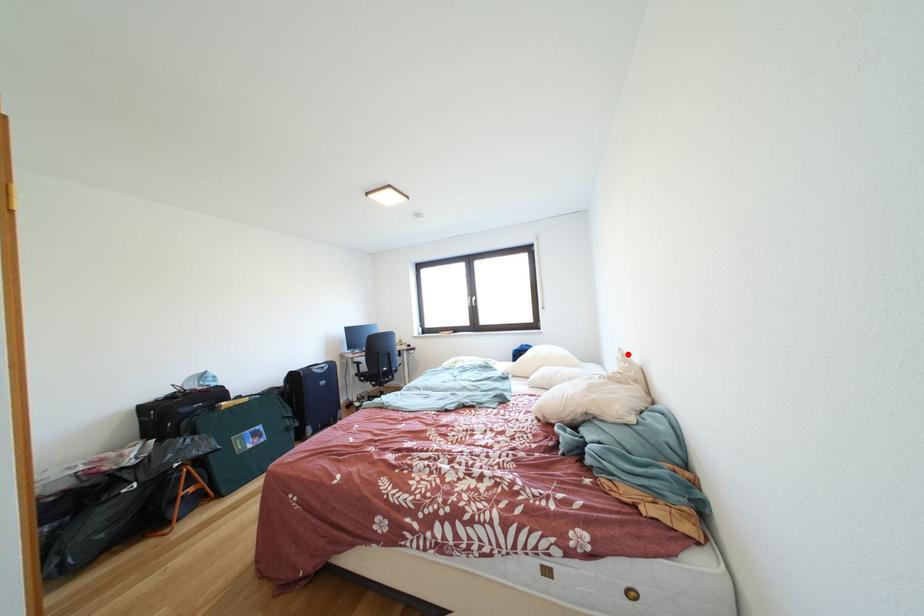
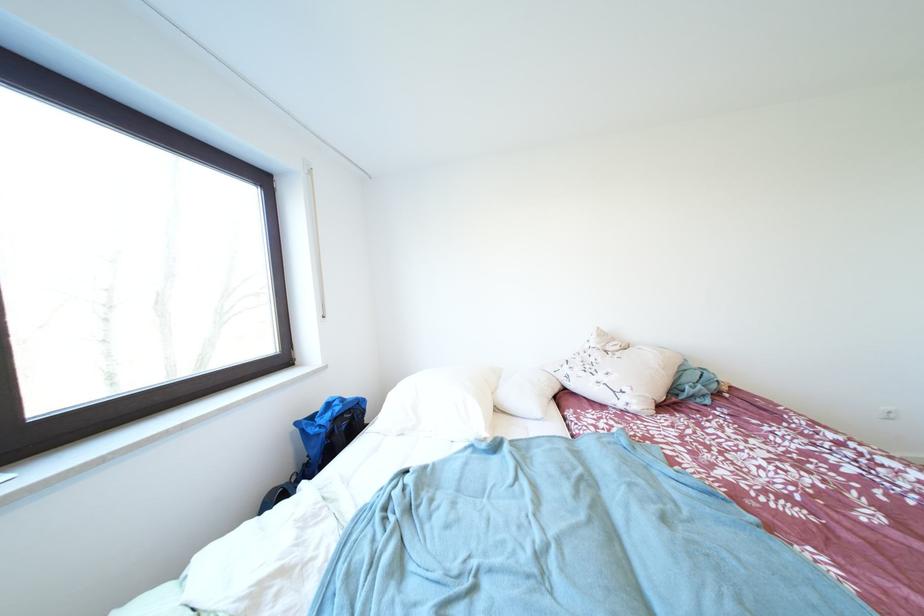
Question: I am providing you with two images of the same scene from different viewpoints. Given a red point in image1, look at the same physical point in image2. Is it:

Choices:
 (A) Closer to the viewpoint
 (B) Farther from the viewpoint

Answer: (B)